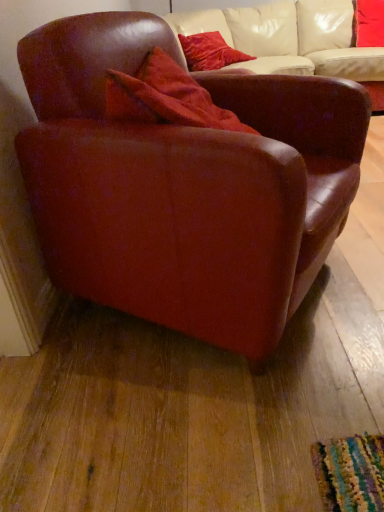
How much space does velvet red pillow at upper center, the first pillow in the left-to-right sequence, occupy vertically?

It is 11.07 inches.

I want to click on velvet red pillow at upper center, acting as the 1th pillow starting from the right, so click(x=368, y=23).

Find the location of a particular element. The width and height of the screenshot is (384, 512). velvet red pillow at upper center, the first pillow in the left-to-right sequence is located at coordinates (209, 52).

Consider the image. Would you say velvet red pillow at upper center, acting as the 1th pillow starting from the right, is outside leather armchair at left?

That's correct, velvet red pillow at upper center, acting as the 1th pillow starting from the right, is outside of leather armchair at left.

From a real-world perspective, does velvet red pillow at upper center, acting as the 1th pillow starting from the right, sit lower than leather armchair at left?

No, from a real-world perspective, velvet red pillow at upper center, acting as the 1th pillow starting from the right, is not under leather armchair at left.

From the image's perspective, is velvet red pillow at upper center, acting as the 1th pillow starting from the right, below leather armchair at left?

Actually, velvet red pillow at upper center, acting as the 1th pillow starting from the right, appears above leather armchair at left in the image.

Between velvet red pillow at upper center, acting as the 1th pillow starting from the right, and leather armchair at left, which one has smaller width?

Thinner between the two is velvet red pillow at upper center, acting as the 1th pillow starting from the right.

From the image's perspective, which one is positioned higher, velvet red pillow at upper center, acting as the 1th pillow starting from the right, or velvet red pillow at upper center, the first pillow in the left-to-right sequence?

velvet red pillow at upper center, acting as the 1th pillow starting from the right, from the image's perspective.

Considering the relative sizes of velvet red pillow at upper center, the second pillow positioned from the left, and velvet red pillow at upper center, the first pillow in the left-to-right sequence, in the image provided, is velvet red pillow at upper center, the second pillow positioned from the left, smaller than velvet red pillow at upper center, the first pillow in the left-to-right sequence,?

Actually, velvet red pillow at upper center, the second pillow positioned from the left, might be larger than velvet red pillow at upper center, the first pillow in the left-to-right sequence.

From a real-world perspective, which is physically below, velvet red pillow at upper center, the second pillow positioned from the left, or velvet red pillow at upper center, the first pillow in the left-to-right sequence?

In real-world perspective, velvet red pillow at upper center, the first pillow in the left-to-right sequence, is lower.

Looking at this image, considering the relative sizes of velvet red pillow at upper center, the second pillow positioned from the left, and velvet red pillow at upper center, the first pillow in the left-to-right sequence, in the image provided, is velvet red pillow at upper center, the second pillow positioned from the left, wider than velvet red pillow at upper center, the first pillow in the left-to-right sequence,?

Indeed, velvet red pillow at upper center, the second pillow positioned from the left, has a greater width compared to velvet red pillow at upper center, the first pillow in the left-to-right sequence.

Considering the points (211, 69) and (305, 82), which point is behind, point (211, 69) or point (305, 82)?

The point (211, 69) is more distant.

From the image's perspective, does velvet red pillow at upper center, the first pillow in the left-to-right sequence, appear lower than leather armchair at left?

Incorrect, from the image's perspective, velvet red pillow at upper center, the first pillow in the left-to-right sequence, is higher than leather armchair at left.

From a real-world perspective, who is located higher, velvet red pillow at upper center, which is the 2th pillow from right to left, or leather armchair at left?

velvet red pillow at upper center, which is the 2th pillow from right to left.

Locate an element on the screen. chair on the left of the velvet red pillow at upper center, the first pillow in the left-to-right sequence is located at coordinates (185, 185).

Would you consider leather armchair at left to be distant from velvet red pillow at upper center, acting as the 1th pillow starting from the right?

Yes.

Does leather armchair at left have a larger size compared to velvet red pillow at upper center, the second pillow positioned from the left?

Indeed, leather armchair at left has a larger size compared to velvet red pillow at upper center, the second pillow positioned from the left.

Is leather armchair at left in front of or behind velvet red pillow at upper center, acting as the 1th pillow starting from the right, in the image?

Clearly, leather armchair at left is in front of velvet red pillow at upper center, acting as the 1th pillow starting from the right.

Visually, is leather armchair at left positioned to the left or to the right of velvet red pillow at upper center, the second pillow positioned from the left?

leather armchair at left is to the left of velvet red pillow at upper center, the second pillow positioned from the left.

Is leather armchair at left surrounding velvet red pillow at upper center, which is the 2th pillow from right to left?

No.

From the image's perspective, which object appears higher, leather armchair at left or velvet red pillow at upper center, the first pillow in the left-to-right sequence?

From the image's view, velvet red pillow at upper center, the first pillow in the left-to-right sequence, is above.

Can you tell me how much leather armchair at left and velvet red pillow at upper center, which is the 2th pillow from right to left, differ in facing direction?

The angular difference between leather armchair at left and velvet red pillow at upper center, which is the 2th pillow from right to left, is 17.9 degrees.

Is leather armchair at left placed right next to velvet red pillow at upper center, the first pillow in the left-to-right sequence?

No, leather armchair at left is not making contact with velvet red pillow at upper center, the first pillow in the left-to-right sequence.

Is velvet red pillow at upper center, which is the 2th pillow from right to left, not near velvet red pillow at upper center, acting as the 1th pillow starting from the right?

Indeed, velvet red pillow at upper center, which is the 2th pillow from right to left, is not near velvet red pillow at upper center, acting as the 1th pillow starting from the right.

Does velvet red pillow at upper center, which is the 2th pillow from right to left, turn towards velvet red pillow at upper center, the second pillow positioned from the left?

No.

Find the location of `pillow that appears above the velvet red pillow at upper center, which is the 2th pillow from right to left (from the image's perspective)`. pillow that appears above the velvet red pillow at upper center, which is the 2th pillow from right to left (from the image's perspective) is located at coordinates (368, 23).

Between velvet red pillow at upper center, the first pillow in the left-to-right sequence, and velvet red pillow at upper center, the second pillow positioned from the left, which one is positioned behind?

velvet red pillow at upper center, the second pillow positioned from the left.

Find the location of a particular element. This screenshot has height=512, width=384. the 2nd pillow behind the leather armchair at left, starting your count from the anchor is located at coordinates (368, 23).

Locate an element on the screen. Image resolution: width=384 pixels, height=512 pixels. pillow that appears below the velvet red pillow at upper center, acting as the 1th pillow starting from the right (from a real-world perspective) is located at coordinates (209, 52).

Estimate the real-world distances between objects in this image. Which object is closer to leather armchair at left, velvet red pillow at upper center, the second pillow positioned from the left, or velvet red pillow at upper center, the first pillow in the left-to-right sequence?

velvet red pillow at upper center, the first pillow in the left-to-right sequence, lies closer to leather armchair at left than the other object.

When comparing their distances from velvet red pillow at upper center, which is the 2th pillow from right to left, does velvet red pillow at upper center, the second pillow positioned from the left, or leather armchair at left seem further?

leather armchair at left is positioned further to the anchor velvet red pillow at upper center, which is the 2th pillow from right to left.

Which object lies nearer to the anchor point velvet red pillow at upper center, which is the 2th pillow from right to left, leather armchair at left or velvet red pillow at upper center, acting as the 1th pillow starting from the right?

Based on the image, velvet red pillow at upper center, acting as the 1th pillow starting from the right, appears to be nearer to velvet red pillow at upper center, which is the 2th pillow from right to left.

In the scene shown: Considering their positions, is velvet red pillow at upper center, which is the 2th pillow from right to left, positioned further to leather armchair at left than velvet red pillow at upper center, acting as the 1th pillow starting from the right?

velvet red pillow at upper center, acting as the 1th pillow starting from the right, lies further to leather armchair at left than the other object.

Which object lies further to the anchor point velvet red pillow at upper center, acting as the 1th pillow starting from the right, leather armchair at left or velvet red pillow at upper center, which is the 2th pillow from right to left?

leather armchair at left is positioned further to the anchor velvet red pillow at upper center, acting as the 1th pillow starting from the right.

Based on their spatial positions, is velvet red pillow at upper center, the first pillow in the left-to-right sequence, or leather armchair at left further from velvet red pillow at upper center, acting as the 1th pillow starting from the right?

Among the two, leather armchair at left is located further to velvet red pillow at upper center, acting as the 1th pillow starting from the right.

Where is `pillow between leather armchair at left and velvet red pillow at upper center, the second pillow positioned from the left, from front to back`? The height and width of the screenshot is (512, 384). pillow between leather armchair at left and velvet red pillow at upper center, the second pillow positioned from the left, from front to back is located at coordinates (209, 52).